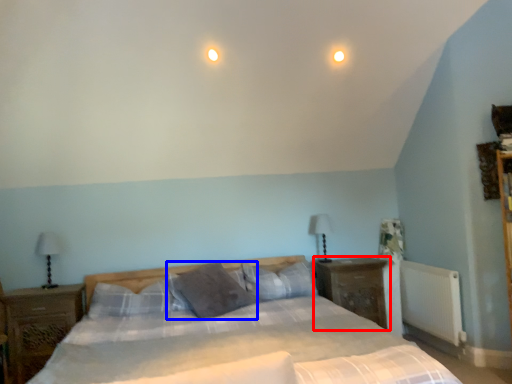
Question: Among these objects, which one is farthest to the camera, nightstand (highlighted by a red box) or pillow (highlighted by a blue box)?

Choices:
 (A) nightstand
 (B) pillow

Answer: (A)